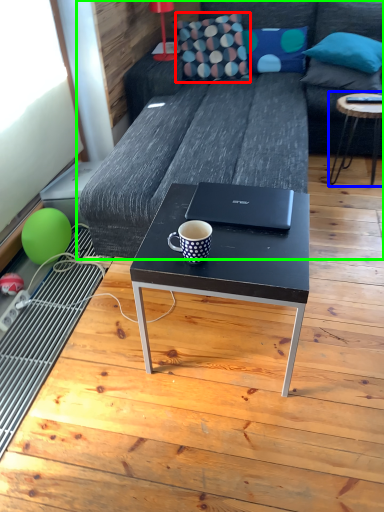
Question: Which object is the closest to the throw pillow (highlighted by a red box)? Choose among these: table (highlighted by a blue box) or studio couch (highlighted by a green box).

Choices:
 (A) table
 (B) studio couch

Answer: (B)